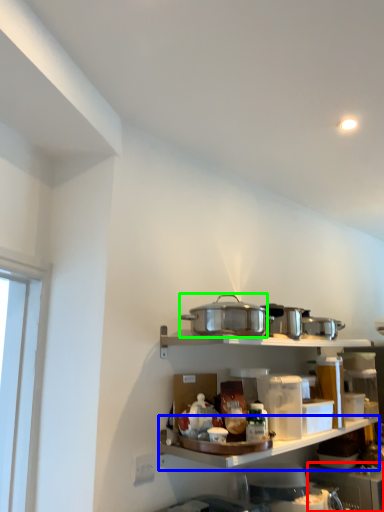
Question: Based on their relative distances, which object is farther from appliance (highlighted by a red box)? Choose from shelf (highlighted by a blue box) and appliance (highlighted by a green box).

Choices:
 (A) shelf
 (B) appliance

Answer: (B)